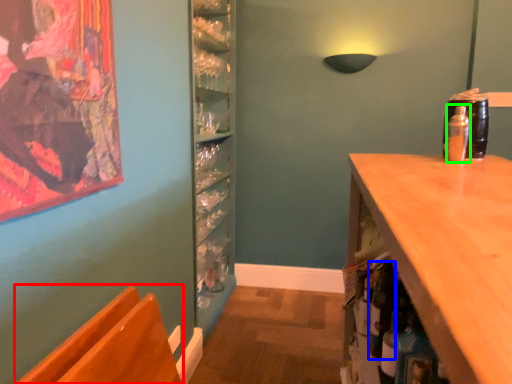
Question: Which object is the farthest from chair (highlighted by a red box)? Choose among these: bottle (highlighted by a blue box) or bottle (highlighted by a green box).

Choices:
 (A) bottle
 (B) bottle

Answer: (B)